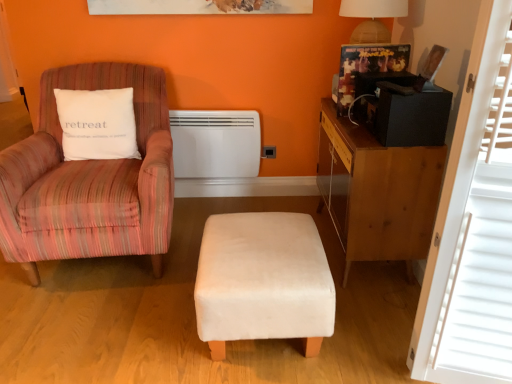
Question: Does white wood window screen at right have a greater height compared to white matte heater at center?

Choices:
 (A) no
 (B) yes

Answer: (B)

Question: Does white wood window screen at right have a smaller size compared to white matte heater at center?

Choices:
 (A) yes
 (B) no

Answer: (B)

Question: Is white wood window screen at right far from white matte heater at center?

Choices:
 (A) no
 (B) yes

Answer: (B)

Question: Is white wood window screen at right behind white matte heater at center?

Choices:
 (A) yes
 (B) no

Answer: (B)

Question: From the image's perspective, is white wood window screen at right located beneath white matte heater at center?

Choices:
 (A) yes
 (B) no

Answer: (A)

Question: In the image, is white wood window screen at right on the left side or the right side of pink striped fabric chair at left?

Choices:
 (A) left
 (B) right

Answer: (B)

Question: From a real-world perspective, is white wood window screen at right above or below pink striped fabric chair at left?

Choices:
 (A) below
 (B) above

Answer: (B)

Question: Based on their sizes in the image, would you say white wood window screen at right is bigger or smaller than pink striped fabric chair at left?

Choices:
 (A) big
 (B) small

Answer: (B)

Question: Is white wood window screen at right wider or thinner than pink striped fabric chair at left?

Choices:
 (A) thin
 (B) wide

Answer: (A)

Question: In the image, is white wood window screen at right on the left side or the right side of wooden desk at right?

Choices:
 (A) right
 (B) left

Answer: (A)

Question: Considering the positions of white wood window screen at right and wooden desk at right in the image, is white wood window screen at right bigger or smaller than wooden desk at right?

Choices:
 (A) small
 (B) big

Answer: (A)

Question: Is white wood window screen at right inside or outside of wooden desk at right?

Choices:
 (A) inside
 (B) outside

Answer: (B)

Question: From a real-world perspective, relative to wooden desk at right, is white wood window screen at right vertically above or below?

Choices:
 (A) below
 (B) above

Answer: (B)

Question: In the image, is white wood window screen at right positioned in front of or behind velvet white stool at center?

Choices:
 (A) front
 (B) behind

Answer: (A)

Question: In terms of width, does white wood window screen at right look wider or thinner when compared to velvet white stool at center?

Choices:
 (A) thin
 (B) wide

Answer: (A)